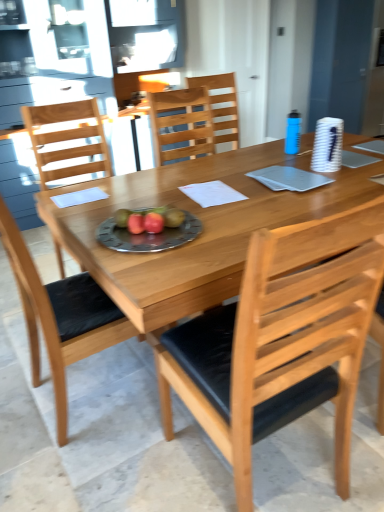
At what (x,y) coordinates should I click in order to perform the action: click on vacant area situated below natural wood chair at center, which is the 4th chair from back to front (from a real-world perspective). Please return your answer as a coordinate pair (x, y). Looking at the image, I should click on (252, 475).